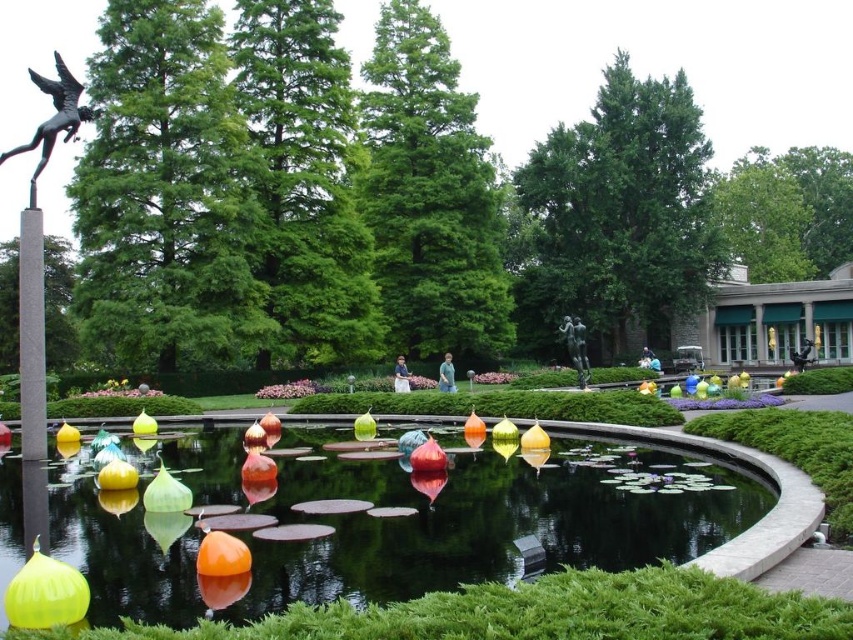
Question: Among these objects, which one is farthest from the camera?

Choices:
 (A) bronze statue at center
 (B) polished bronze bird at upper left
 (C) translucent glass pond at center

Answer: (A)

Question: Among these objects, which one is farthest from the camera?

Choices:
 (A) translucent glass pond at center
 (B) bronze statue at center
 (C) polished bronze bird at upper left

Answer: (B)

Question: From the image, what is the correct spatial relationship of translucent glass pond at center in relation to bronze statue at center?

Choices:
 (A) below
 (B) above

Answer: (A)

Question: Is translucent glass pond at center below bronze statue at center?

Choices:
 (A) no
 (B) yes

Answer: (B)

Question: Can you confirm if translucent glass pond at center is bigger than polished bronze bird at upper left?

Choices:
 (A) yes
 (B) no

Answer: (B)

Question: Which object appears closest to the camera in this image?

Choices:
 (A) bronze statue at center
 (B) translucent glass pond at center
 (C) polished bronze bird at upper left

Answer: (B)